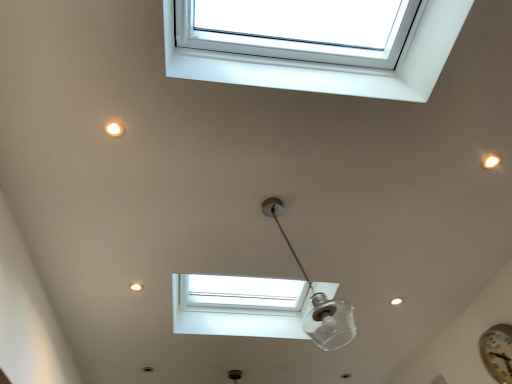
Question: From a real-world perspective, is transparent glass lamp at center positioned above or below metallic silver clock at lower right?

Choices:
 (A) below
 (B) above

Answer: (B)

Question: Is transparent glass lamp at center in front of or behind metallic silver clock at lower right in the image?

Choices:
 (A) behind
 (B) front

Answer: (B)

Question: Which object is the closest to the metallic silver clock at lower right?

Choices:
 (A) white plastic window at upper center
 (B) transparent glass lamp at center

Answer: (B)

Question: Which object is positioned closest to the white plastic window at upper center?

Choices:
 (A) transparent glass lamp at center
 (B) metallic silver clock at lower right

Answer: (A)